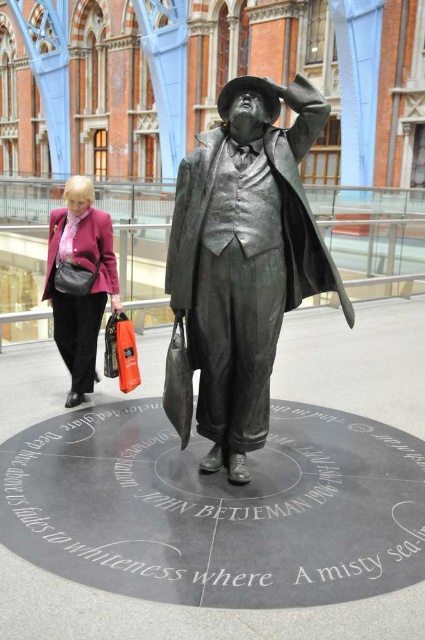
Who is positioned more to the right, bronze statue at center or matte pink blazer at left?

bronze statue at center is more to the right.

This screenshot has width=425, height=640. In order to click on bronze statue at center in this screenshot , I will do `click(244, 257)`.

Where is `bronze statue at center`? The height and width of the screenshot is (640, 425). bronze statue at center is located at coordinates click(244, 257).